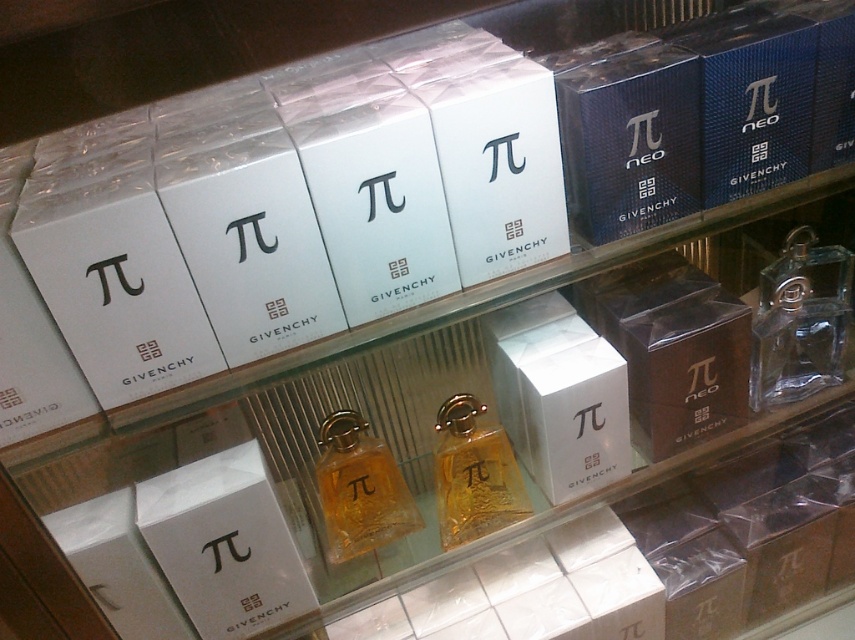
Is clear glass perfume at center to the left of translucent amber glass perfume at center from the viewer's perspective?

No, clear glass perfume at center is not to the left of translucent amber glass perfume at center.

Does clear glass perfume at center have a lesser height compared to translucent amber glass perfume at center?

In fact, clear glass perfume at center may be taller than translucent amber glass perfume at center.

Locate an element on the screen. This screenshot has width=855, height=640. clear glass perfume at center is located at coordinates (799, 321).

Where is `clear glass perfume at center`? The width and height of the screenshot is (855, 640). clear glass perfume at center is located at coordinates (799, 321).

Is point (767, 355) positioned after point (438, 518)?

No, (767, 355) is in front of (438, 518).

Describe the element at coordinates (799, 321) in the screenshot. I see `clear glass perfume at center` at that location.

Between point (803, 358) and point (463, 392), which one is positioned behind?

The point (463, 392) is behind.

Identify the location of clear glass perfume at center. The height and width of the screenshot is (640, 855). (799, 321).

Measure the distance between translucent amber glass perfume at center and golden glass perfume at center.

translucent amber glass perfume at center and golden glass perfume at center are 9.90 centimeters apart.

Who is lower down, translucent amber glass perfume at center or golden glass perfume at center?

translucent amber glass perfume at center

Is point (346, 424) positioned before point (451, 417)?

That is True.

Where is `translucent amber glass perfume at center`? This screenshot has height=640, width=855. translucent amber glass perfume at center is located at coordinates (360, 488).